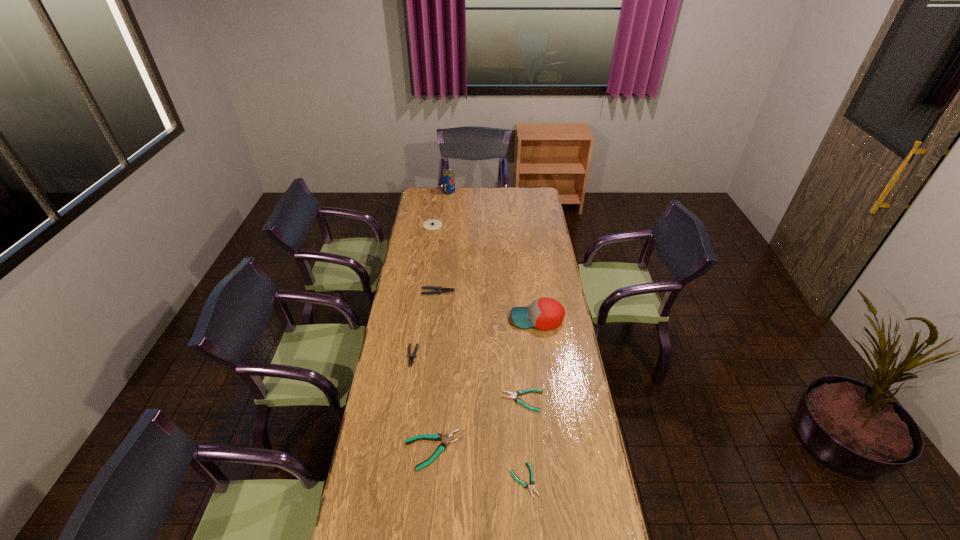
The image size is (960, 540). In the image, there is a desktop. In order to click on free space at the far edge in this screenshot , I will do `click(457, 201)`.

Locate an element on the screen. vacant area at the left edge is located at coordinates (423, 249).

At what (x,y) coordinates should I click in order to perform the action: click on vacant space at the right edge of the desktop. Please return your answer as a coordinate pair (x, y). Image resolution: width=960 pixels, height=540 pixels. Looking at the image, I should click on (604, 502).

At what (x,y) coordinates should I click in order to perform the action: click on free space at the far left corner of the desktop. Please return your answer as a coordinate pair (x, y). Looking at the image, I should click on (429, 205).

In the image, there is a desktop. At what (x,y) coordinates should I click in order to perform the action: click on vacant space at the far right corner. Please return your answer as a coordinate pair (x, y). The image size is (960, 540). Looking at the image, I should click on (542, 193).

Find the location of a particular element. This screenshot has width=960, height=540. vacant point located between the smaller gray pliers and the second tallest object is located at coordinates (475, 338).

Locate an element on the screen. The image size is (960, 540). free space between the smallest teal pliers and the fourth nearest object is located at coordinates (468, 418).

Locate an element on the screen. free space between the tallest object and the third nearest pliers is located at coordinates (486, 296).

Locate an element on the screen. Image resolution: width=960 pixels, height=540 pixels. vacant region between the smallest teal pliers and the third shortest object is located at coordinates (478, 465).

Locate an element on the screen. This screenshot has width=960, height=540. blank region between the sixth farthest object and the smaller gray pliers is located at coordinates (468, 379).